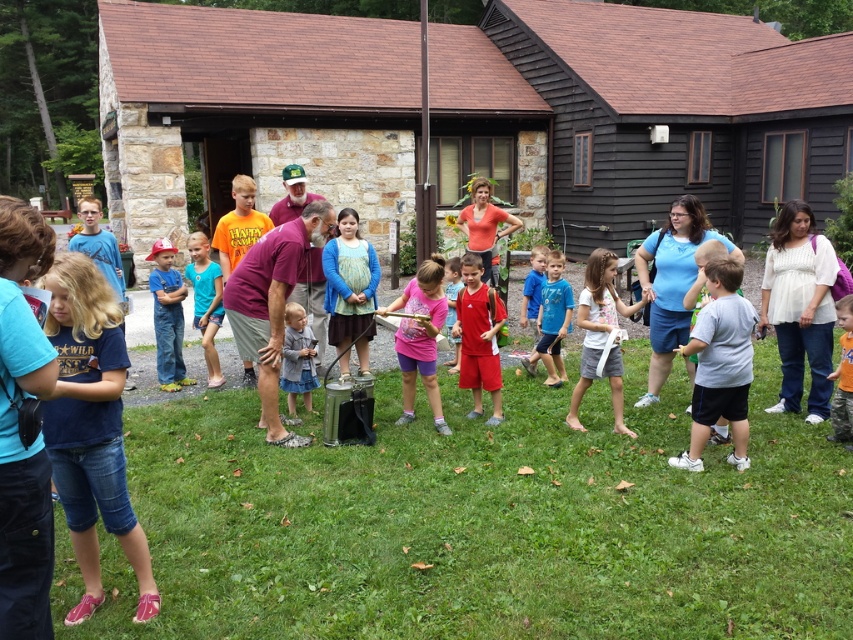
You are standing at the point marked at coordinates (254,109). Which object are you closest to?

The point marked at coordinates (254,109) is on the brown stone hut at center, so you are closest to the brown stone hut at center.

You are standing at the point labeled point (213,330) and want to walk to the point labeled point (479,390). Which direction should you move in to get closer to the camera?

You should move towards point (479,390) because it is closer to the camera than point (213,330).

You are a photographer trying to capture a photo of the brown stone hut at center and the blue cotton shirt at center. Based on their heights, which object should you focus on first if you want to ensure both are in frame without adjusting your camera angle?

The brown stone hut at center is taller than the blue cotton shirt at center, so you should focus on the brown stone hut at center first to ensure both are in frame without adjusting your camera angle.